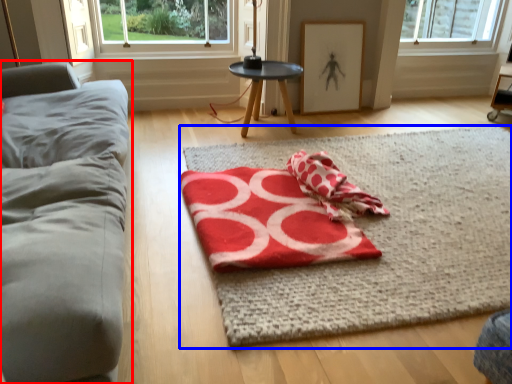
Question: Which point is further to the camera, studio couch (highlighted by a red box) or yoga mat (highlighted by a blue box)?

Choices:
 (A) studio couch
 (B) yoga mat

Answer: (B)